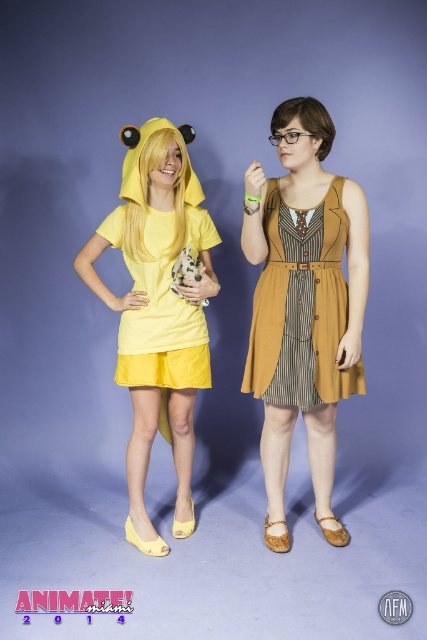
You are a costume designer preparing for a play and need to choose between two dresses displayed in the image. The mustard fabric dress at center and the matte yellow dress at center. Based on their sizes, which dress would require more fabric to make?

The matte yellow dress at center requires more fabric because it occupies more space than the mustard fabric dress at center.

You are a fashion designer observing two dresses displayed in the center of the image. The mustard fabric dress at center and the matte yellow dress at center. Which dress is taller?

The mustard fabric dress at center is taller than the matte yellow dress at center.